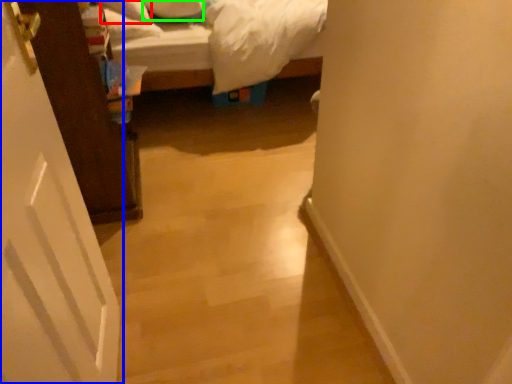
Question: Which object is the closest to the pillow (highlighted by a red box)? Choose among these: door (highlighted by a blue box) or pillow (highlighted by a green box).

Choices:
 (A) door
 (B) pillow

Answer: (B)